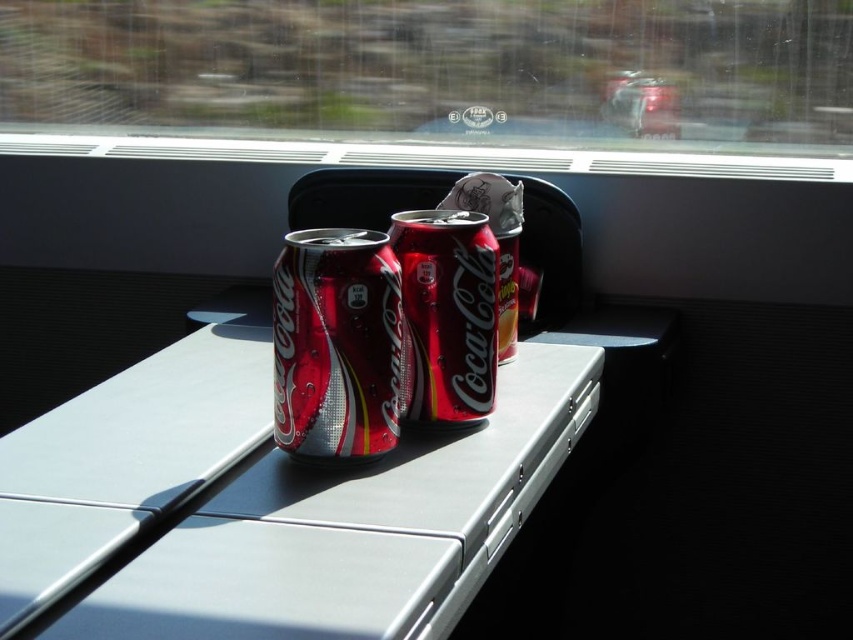
Question: Estimate the real-world distances between objects in this image. Which object is farther from the shiny metallic can at center?

Choices:
 (A) metallic gray table at center
 (B) metallic silver window sill at center
 (C) transparent glass train window at center

Answer: (C)

Question: Which object appears farthest from the camera in this image?

Choices:
 (A) shiny metallic can at center
 (B) transparent glass train window at center
 (C) metallic silver window sill at center
 (D) metallic gray table at center

Answer: (B)

Question: Based on their relative distances, which object is farther from the transparent glass train window at center?

Choices:
 (A) shiny metallic can at center
 (B) metallic gray table at center
 (C) metallic silver window sill at center

Answer: (A)

Question: Is metallic gray table at center positioned at the back of metallic silver window sill at center?

Choices:
 (A) yes
 (B) no

Answer: (B)

Question: Can you confirm if shiny metallic can at center is positioned below metallic silver window sill at center?

Choices:
 (A) no
 (B) yes

Answer: (B)

Question: Does metallic gray table at center lie in front of transparent glass train window at center?

Choices:
 (A) yes
 (B) no

Answer: (A)